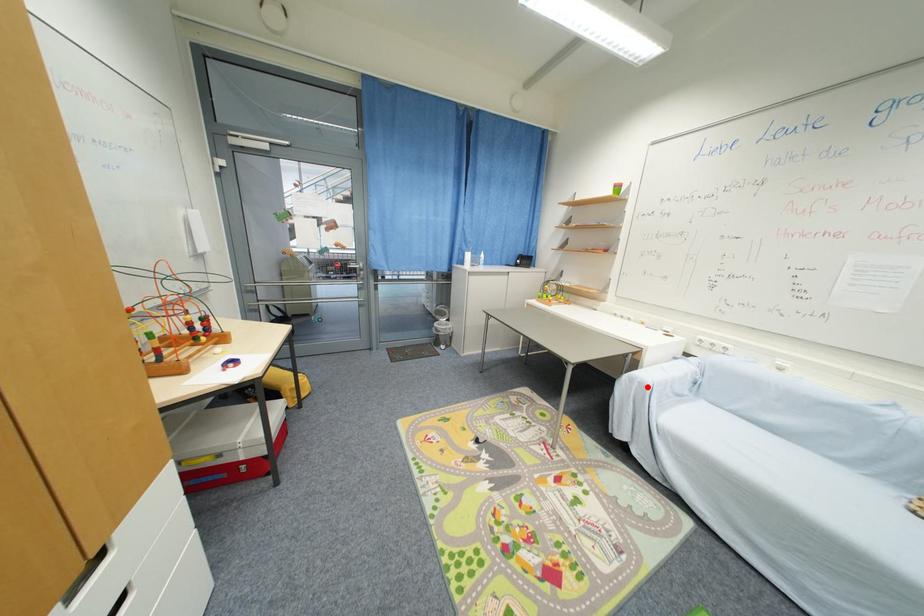
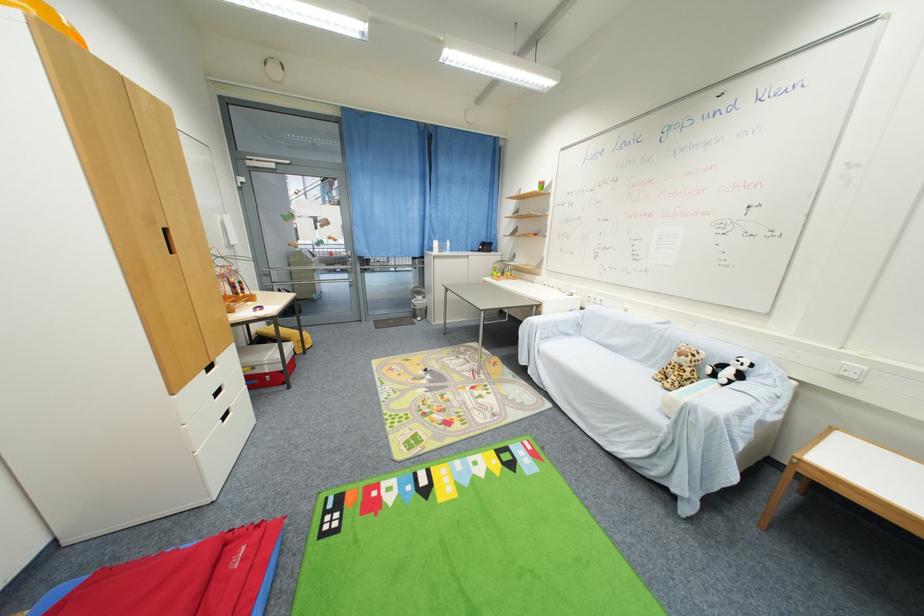
In the second image, find the point that corresponds to the highlighted location in the first image.

(537, 326)